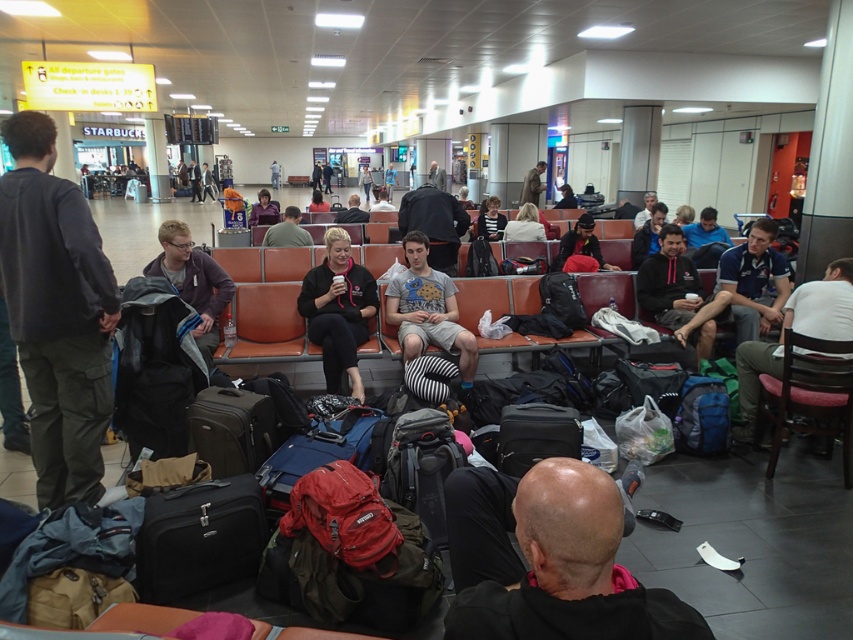
You are a traveler looking for your luggage. You see a dark gray fleece jacket at center and a light brown leather jacket at center. Which jacket is closer to the left side of the scene?

The dark gray fleece jacket at center is closer to the left side of the scene because it is positioned to the left of the light brown leather jacket at center.

You are a traveler standing in the airport waiting area. You want to sit down on the pink fabric chair at lower right but first need to pass by the striped fabric shirt at center. Can you walk directly from your current position to the chair without going around?

The pink fabric chair at lower right is closer to the viewer than striped fabric shirt at center, so yes, you can walk directly to the pink fabric chair at lower right because it is in front of the striped fabric shirt at center and not blocked by it.

You are a traveler who wants to sit down. You see a pink fabric chair at lower right and a striped fabric shirt at center. Which object is closer to you?

The pink fabric chair at lower right is closer to you because it is positioned under the striped fabric shirt at center, meaning it is in front of it from your perspective.